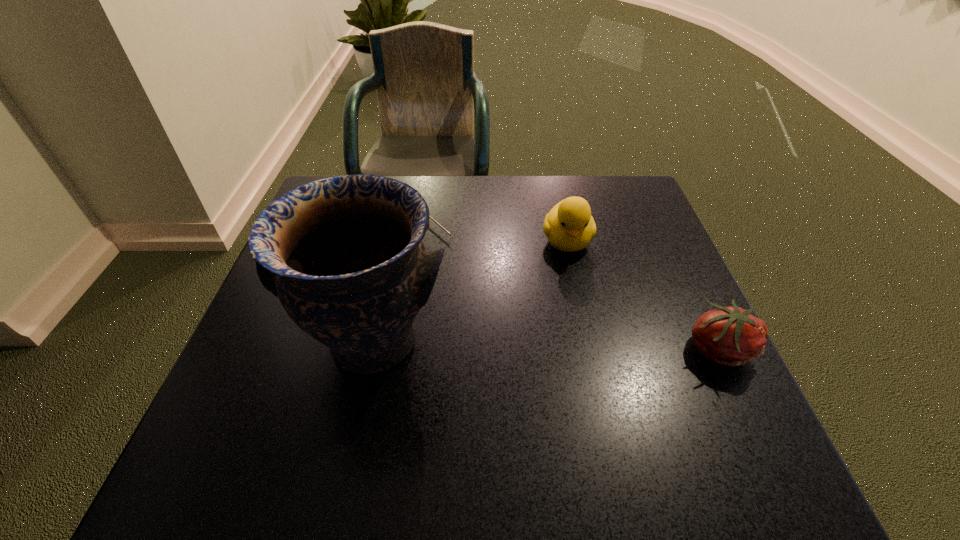
The width and height of the screenshot is (960, 540). Identify the location of vacant region located 0.290m on the front-facing side of the third object from left to right. (592, 367).

At what (x,y) coordinates should I click in order to perform the action: click on vacant space located on the front-facing side of the third object from left to right. Please return your answer as a coordinate pair (x, y). Looking at the image, I should click on (601, 411).

You are a GUI agent. You are given a task and a screenshot of the screen. Output one action in this format:
    pyautogui.click(x=<x>, y=<y>)
    Task: Click on the screwdriver located in the far edge section of the desktop
    The height and width of the screenshot is (540, 960).
    Given the screenshot: What is the action you would take?
    pyautogui.click(x=430, y=217)

Locate an element on the screen. This screenshot has height=540, width=960. duck that is positioned at the far edge is located at coordinates (569, 226).

Where is `object located in the near edge section of the desktop`? This screenshot has height=540, width=960. object located in the near edge section of the desktop is located at coordinates point(344,255).

Where is `object that is at the left edge`? object that is at the left edge is located at coordinates (344, 255).

The image size is (960, 540). I want to click on object that is at the right edge, so click(x=731, y=336).

The height and width of the screenshot is (540, 960). Find the location of `object situated at the near left corner`. object situated at the near left corner is located at coordinates pos(344,255).

Where is `vacant space at the far edge of the desktop`? vacant space at the far edge of the desktop is located at coordinates (569, 189).

Locate an element on the screen. The image size is (960, 540). free point at the near edge is located at coordinates (344, 396).